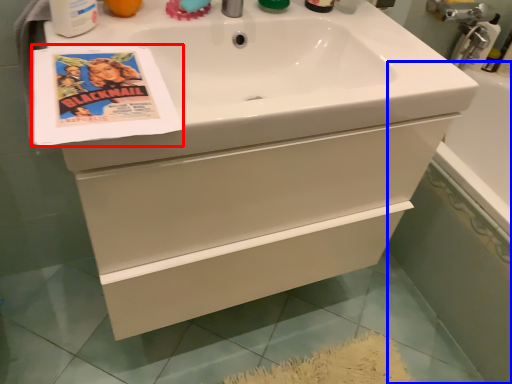
Question: Which point is closer to the camera, flyer (highlighted by a red box) or bath (highlighted by a blue box)?

Choices:
 (A) flyer
 (B) bath

Answer: (A)